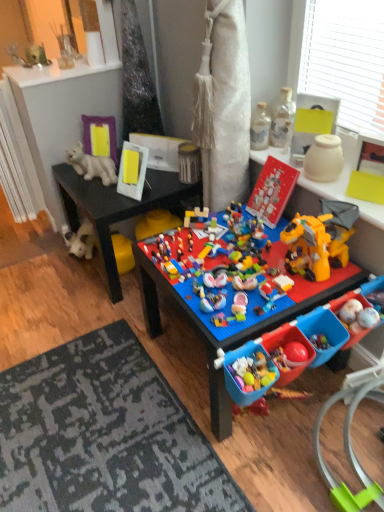
This screenshot has width=384, height=512. What do you see at coordinates (324, 159) in the screenshot? I see `white matte vase at upper right, the first toy from the right` at bounding box center [324, 159].

You are a GUI agent. You are given a task and a screenshot of the screen. Output one action in this format:
    pyautogui.click(x=<x>, y=<y>)
    Task: Click on the white textured radiator at left
    Image resolution: width=384 pixels, height=512 pixels.
    Given the screenshot: What is the action you would take?
    pyautogui.click(x=17, y=161)

What is the approximate height of matte plastic toy at center, the second toy when ordered from right to left?

9.07 inches.

The height and width of the screenshot is (512, 384). In order to click on brick-like plastic lego set at center, arranged as the fourth toy when viewed from the right in this screenshot , I will do `click(220, 268)`.

Where is `blue plastic table at center`? This screenshot has width=384, height=512. blue plastic table at center is located at coordinates (231, 302).

Where is `white matte polar bear at upper left, which is the sixth toy in right-to-left order`? white matte polar bear at upper left, which is the sixth toy in right-to-left order is located at coordinates (91, 165).

From the image's perspective, is metallic can at center, which ranks as the 5th toy in right-to-left order, on top of white textured radiator at left?

Actually, metallic can at center, which ranks as the 5th toy in right-to-left order, appears below white textured radiator at left in the image.

Locate an element on the screen. The image size is (384, 512). the 2nd toy in front of the white textured radiator at left, starting your count from the anchor is located at coordinates (189, 163).

Is metallic can at center, arranged as the 3th toy when viewed from the left, next to white textured radiator at left and touching it?

No, metallic can at center, arranged as the 3th toy when viewed from the left, is not in contact with white textured radiator at left.

Is white plush dog at lower left, which ranks as the seventh toy in right-to-left order, looking in the opposite direction of metallic can at center, which ranks as the 5th toy in right-to-left order?

No, white plush dog at lower left, which ranks as the seventh toy in right-to-left order, is not facing away from metallic can at center, which ranks as the 5th toy in right-to-left order.

Are white plush dog at lower left, which ranks as the seventh toy in right-to-left order, and metallic can at center, arranged as the 3th toy when viewed from the left, located far from each other?

No, white plush dog at lower left, which ranks as the seventh toy in right-to-left order, is not far away from metallic can at center, arranged as the 3th toy when viewed from the left.

There is a white plush dog at lower left, the 1th toy from the left. Where is `the 3rd toy above it (from the image's perspective)`? This screenshot has height=512, width=384. the 3rd toy above it (from the image's perspective) is located at coordinates (189, 163).

Who is smaller, white plush dog at lower left, the 1th toy from the left, or metallic can at center, arranged as the 3th toy when viewed from the left?

Smaller between the two is metallic can at center, arranged as the 3th toy when viewed from the left.

Is white matte polar bear at upper left, which is the 2th toy in left-to-right order, at the left side of brick-like plastic lego set at center, which is counted as the fourth toy, starting from the left?

Yes.

What's the angular difference between white matte polar bear at upper left, which is the sixth toy in right-to-left order, and brick-like plastic lego set at center, arranged as the fourth toy when viewed from the right,'s facing directions?

There is a 42.9-degree angle between the facing directions of white matte polar bear at upper left, which is the sixth toy in right-to-left order, and brick-like plastic lego set at center, arranged as the fourth toy when viewed from the right.

Which is correct: white matte polar bear at upper left, which is the sixth toy in right-to-left order, is inside brick-like plastic lego set at center, arranged as the fourth toy when viewed from the right, or outside of it?

white matte polar bear at upper left, which is the sixth toy in right-to-left order, cannot be found inside brick-like plastic lego set at center, arranged as the fourth toy when viewed from the right.

Is clear glass bottle at upper right, the fifth toy when ordered from left to right, at the right side of white plush dog at lower left, which ranks as the seventh toy in right-to-left order?

Correct, you'll find clear glass bottle at upper right, the fifth toy when ordered from left to right, to the right of white plush dog at lower left, which ranks as the seventh toy in right-to-left order.

Is clear glass bottle at upper right, the fifth toy when ordered from left to right, positioned with its back to white plush dog at lower left, the 1th toy from the left?

No, clear glass bottle at upper right, the fifth toy when ordered from left to right,'s orientation is not away from white plush dog at lower left, the 1th toy from the left.

How different are the orientations of clear glass bottle at upper right, the fifth toy when ordered from left to right, and white plush dog at lower left, which ranks as the seventh toy in right-to-left order, in degrees?

clear glass bottle at upper right, the fifth toy when ordered from left to right, and white plush dog at lower left, which ranks as the seventh toy in right-to-left order, are facing 16.8 degrees away from each other.

Considering the sizes of brick-like plastic lego set at center, arranged as the fourth toy when viewed from the right, and black matte desk at center in the image, is brick-like plastic lego set at center, arranged as the fourth toy when viewed from the right, taller or shorter than black matte desk at center?

In the image, brick-like plastic lego set at center, arranged as the fourth toy when viewed from the right, appears to be shorter than black matte desk at center.

How many degrees apart are the facing directions of brick-like plastic lego set at center, which is counted as the fourth toy, starting from the left, and black matte desk at center?

brick-like plastic lego set at center, which is counted as the fourth toy, starting from the left, and black matte desk at center are facing 4.03 degrees away from each other.

From the image's perspective, is brick-like plastic lego set at center, which is counted as the fourth toy, starting from the left, above or below black matte desk at center?

Based on their image positions, brick-like plastic lego set at center, which is counted as the fourth toy, starting from the left, is located beneath black matte desk at center.

Is point (314, 289) positioned after point (325, 141)?

No, (314, 289) is in front of (325, 141).

Consider the image. Which is more to the right, blue plastic table at center or white matte vase at upper right, marked as the 7th toy in a left-to-right arrangement?

Positioned to the right is white matte vase at upper right, marked as the 7th toy in a left-to-right arrangement.

Is blue plastic table at center situated inside white matte vase at upper right, marked as the 7th toy in a left-to-right arrangement, or outside?

blue plastic table at center exists outside the volume of white matte vase at upper right, marked as the 7th toy in a left-to-right arrangement.

Based on the photo, who is smaller, blue plastic table at center or white matte vase at upper right, marked as the 7th toy in a left-to-right arrangement?

With smaller size is white matte vase at upper right, marked as the 7th toy in a left-to-right arrangement.

From the image's perspective, which is above, matte plastic toy at center, the second toy when ordered from right to left, or brick-like plastic lego set at center, arranged as the fourth toy when viewed from the right?

matte plastic toy at center, the second toy when ordered from right to left, appears higher in the image.

Relative to brick-like plastic lego set at center, arranged as the fourth toy when viewed from the right, is matte plastic toy at center, the second toy when ordered from right to left, in front or behind?

→ matte plastic toy at center, the second toy when ordered from right to left, is positioned farther from the viewer than brick-like plastic lego set at center, arranged as the fourth toy when viewed from the right.

From the picture: Is matte plastic toy at center, the second toy when ordered from right to left, to the right of brick-like plastic lego set at center, which is counted as the fourth toy, starting from the left, from the viewer's perspective?

Correct, you'll find matte plastic toy at center, the second toy when ordered from right to left, to the right of brick-like plastic lego set at center, which is counted as the fourth toy, starting from the left.

This screenshot has height=512, width=384. Find the location of `the 3rd toy below the white textured radiator at left (from the image's perspective)`. the 3rd toy below the white textured radiator at left (from the image's perspective) is located at coordinates (189, 163).

You are a GUI agent. You are given a task and a screenshot of the screen. Output one action in this format:
    pyautogui.click(x=<x>, y=<y>)
    Task: Click on the 2nd toy to the left when counting from the metallic can at center, which ranks as the 5th toy in right-to-left order
    This screenshot has width=384, height=512.
    Given the screenshot: What is the action you would take?
    pyautogui.click(x=81, y=241)

Estimate the real-world distances between objects in this image. Which object is closer to brick-like plastic lego set at center, which is counted as the fourth toy, starting from the left, matte plastic toy at center, which is the 6th toy from left to right, or white matte vase at upper right, the first toy from the right?

Based on the image, matte plastic toy at center, which is the 6th toy from left to right, appears to be nearer to brick-like plastic lego set at center, which is counted as the fourth toy, starting from the left.

When comparing their distances from white plush dog at lower left, which ranks as the seventh toy in right-to-left order, does metallic can at center, which ranks as the 5th toy in right-to-left order, or white matte vase at upper right, marked as the 7th toy in a left-to-right arrangement, seem closer?

Among the two, metallic can at center, which ranks as the 5th toy in right-to-left order, is located nearer to white plush dog at lower left, which ranks as the seventh toy in right-to-left order.

Estimate the real-world distances between objects in this image. Which object is closer to white textured radiator at left, clear glass bottle at upper right, the fifth toy when ordered from left to right, or metallic can at center, arranged as the 3th toy when viewed from the left?

metallic can at center, arranged as the 3th toy when viewed from the left, lies closer to white textured radiator at left than the other object.

Considering their positions, is blue plastic table at center positioned further to matte plastic toy at center, which is the 6th toy from left to right, than brick-like plastic lego set at center, which is counted as the fourth toy, starting from the left?

blue plastic table at center lies further to matte plastic toy at center, which is the 6th toy from left to right, than the other object.

Estimate the real-world distances between objects in this image. Which object is further from white matte polar bear at upper left, which is the sixth toy in right-to-left order, black matte desk at center or white matte vase at upper right, the first toy from the right?

white matte vase at upper right, the first toy from the right, lies further to white matte polar bear at upper left, which is the sixth toy in right-to-left order, than the other object.

Considering their positions, is white textured radiator at left positioned further to brick-like plastic lego set at center, which is counted as the fourth toy, starting from the left, than black matte desk at center?

Among the two, white textured radiator at left is located further to brick-like plastic lego set at center, which is counted as the fourth toy, starting from the left.

Considering their positions, is black matte desk at center positioned further to white textured radiator at left than metallic can at center, which ranks as the 5th toy in right-to-left order?

metallic can at center, which ranks as the 5th toy in right-to-left order, lies further to white textured radiator at left than the other object.

Which object lies further to the anchor point white matte polar bear at upper left, which is the 2th toy in left-to-right order, metallic can at center, arranged as the 3th toy when viewed from the left, or blue plastic table at center?

blue plastic table at center is further to white matte polar bear at upper left, which is the 2th toy in left-to-right order.

The height and width of the screenshot is (512, 384). I want to click on table situated between white plush dog at lower left, which ranks as the seventh toy in right-to-left order, and white matte vase at upper right, the first toy from the right, from left to right, so click(x=231, y=302).

I want to click on desk located between white plush dog at lower left, which ranks as the seventh toy in right-to-left order, and metallic can at center, arranged as the 3th toy when viewed from the left, in the left-right direction, so click(117, 208).

Identify the location of table situated between white textured radiator at left and matte plastic toy at center, the second toy when ordered from right to left, from left to right. The image size is (384, 512). (231, 302).

Identify the location of table between black matte desk at center and matte plastic toy at center, the second toy when ordered from right to left, from left to right. 231,302.